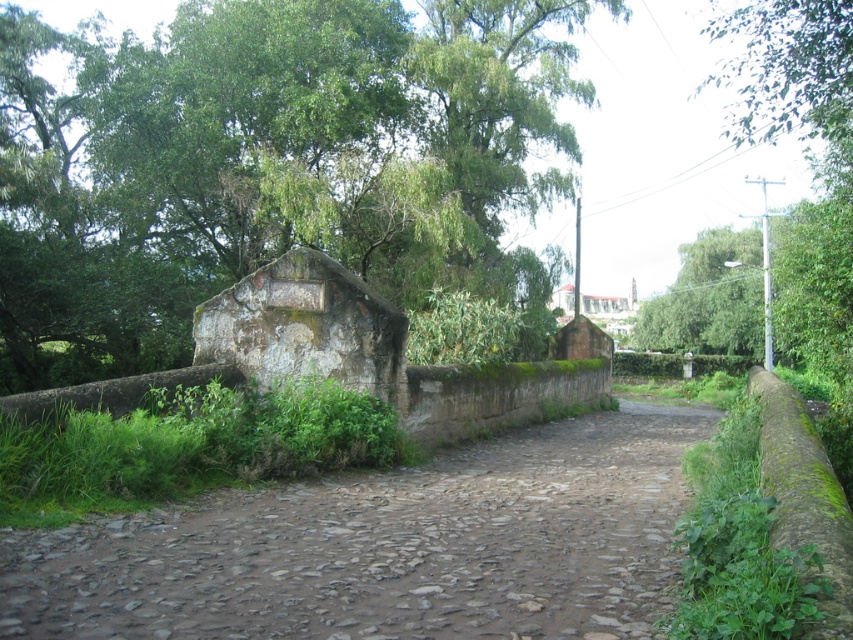
Question: Among these objects, which one is nearest to the camera?

Choices:
 (A) brown stone path at center
 (B) green leafy tree at upper center

Answer: (A)

Question: Among these points, which one is farthest from the camera?

Choices:
 (A) (177, 38)
 (B) (364, 529)

Answer: (A)

Question: Does green leafy tree at upper center have a smaller size compared to brown stone path at center?

Choices:
 (A) no
 (B) yes

Answer: (A)

Question: Which point appears closest to the camera in this image?

Choices:
 (A) (380, 556)
 (B) (422, 168)

Answer: (A)

Question: Considering the relative positions of green leafy tree at upper center and brown stone path at center in the image provided, where is green leafy tree at upper center located with respect to brown stone path at center?

Choices:
 (A) left
 (B) right

Answer: (A)

Question: Is green leafy tree at upper center thinner than brown stone path at center?

Choices:
 (A) yes
 (B) no

Answer: (B)